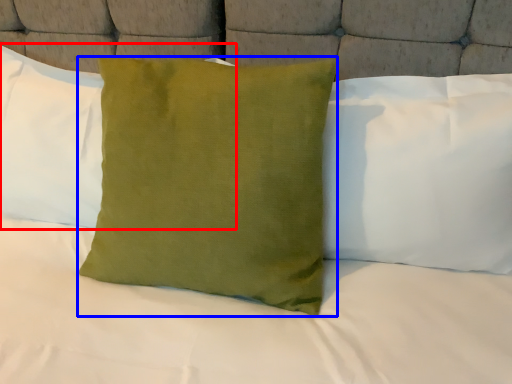
Question: Among these objects, which one is farthest to the camera, pillow (highlighted by a red box) or pillow (highlighted by a blue box)?

Choices:
 (A) pillow
 (B) pillow

Answer: (A)